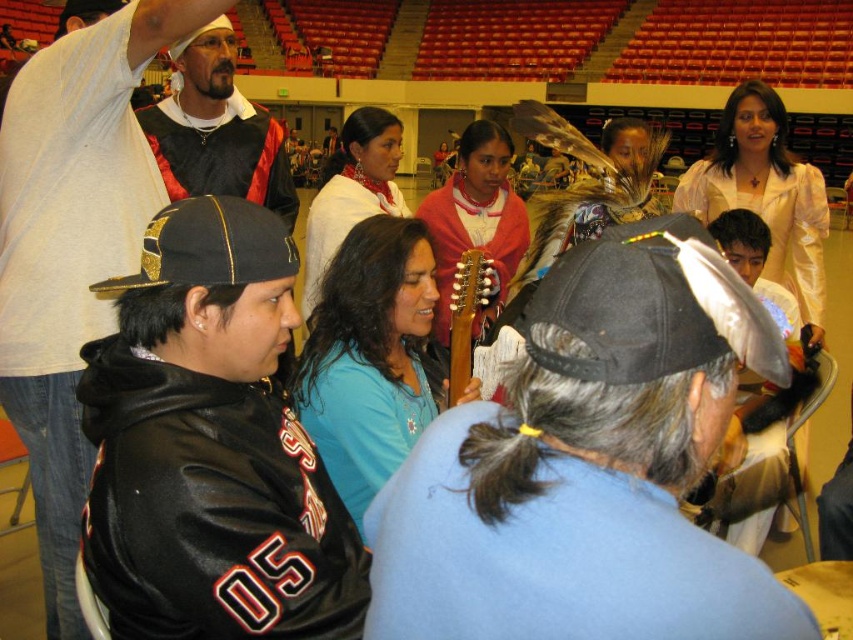
Question: Can you confirm if black leather jacket at lower left is thinner than matte black and red fabric at upper left?

Choices:
 (A) yes
 (B) no

Answer: (B)

Question: Is black fabric baseball cap at center above black leather baseball cap at center-left?

Choices:
 (A) yes
 (B) no

Answer: (B)

Question: Among these objects, which one is nearest to the camera?

Choices:
 (A) black fabric baseball cap at center
 (B) black leather jacket at lower left

Answer: (A)

Question: Which of the following is the closest to the observer?

Choices:
 (A) matte black and red fabric at upper left
 (B) black leather jacket at lower left
 (C) black fabric baseball cap at center

Answer: (C)

Question: Which of these objects is positioned farthest from the black fabric baseball cap at center?

Choices:
 (A) black leather baseball cap at center-left
 (B) matte black and red fabric at upper left
 (C) black leather jacket at lower left
 (D) brown wooden guitar at center

Answer: (B)

Question: From the image, what is the correct spatial relationship of black fabric baseball cap at center in relation to brown wooden guitar at center?

Choices:
 (A) right
 (B) left

Answer: (A)